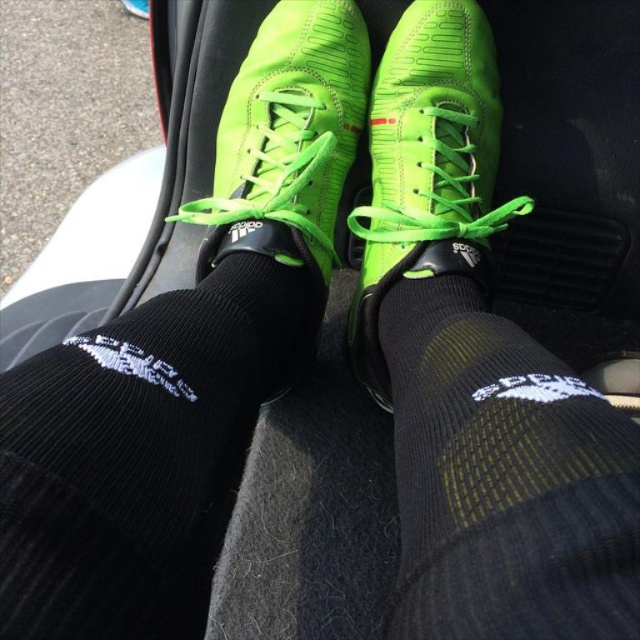
Which of these two, black ribbed sock at center or neon green leather shoe at center, stands shorter?

With less height is black ribbed sock at center.

Who is lower down, black ribbed sock at center or neon green leather shoe at center?

black ribbed sock at center is lower down.

Is point (198, 435) behind point (499, 100)?

No, (198, 435) is closer to viewer.

At what (x,y) coordinates should I click in order to perform the action: click on black ribbed sock at center. Please return your answer as a coordinate pair (x, y). Looking at the image, I should click on (140, 452).

Who is more forward, (492, 604) or (321, 246)?

Point (492, 604) is more forward.

Does black textured sock at center appear on the right side of neon green suede shoe at center?

Correct, you'll find black textured sock at center to the right of neon green suede shoe at center.

Between point (448, 618) and point (308, 3), which one is positioned behind?

The point (308, 3) is more distant.

You are a GUI agent. You are given a task and a screenshot of the screen. Output one action in this format:
    pyautogui.click(x=<x>, y=<y>)
    Task: Click on the black textured sock at center
    The height and width of the screenshot is (640, 640).
    Given the screenshot: What is the action you would take?
    pyautogui.click(x=502, y=480)

The width and height of the screenshot is (640, 640). Describe the element at coordinates (140, 452) in the screenshot. I see `black ribbed sock at center` at that location.

Does point (49, 621) come in front of point (305, 189)?

That is True.

Between point (176, 502) and point (305, 4), which one is positioned in front?

Point (176, 502)

Where is `black ribbed sock at center`? This screenshot has width=640, height=640. black ribbed sock at center is located at coordinates (140, 452).